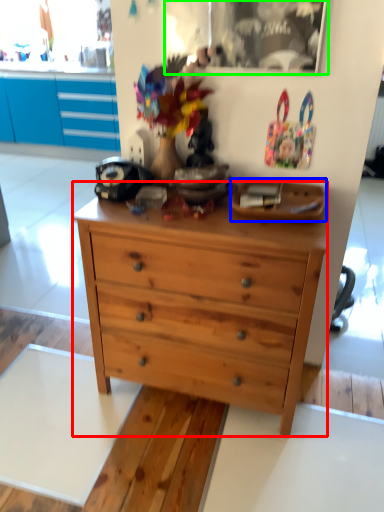
Question: Which object is positioned farthest from chest of drawers (highlighted by a red box)? Select from plate (highlighted by a blue box) and picture frame (highlighted by a green box).

Choices:
 (A) plate
 (B) picture frame

Answer: (B)